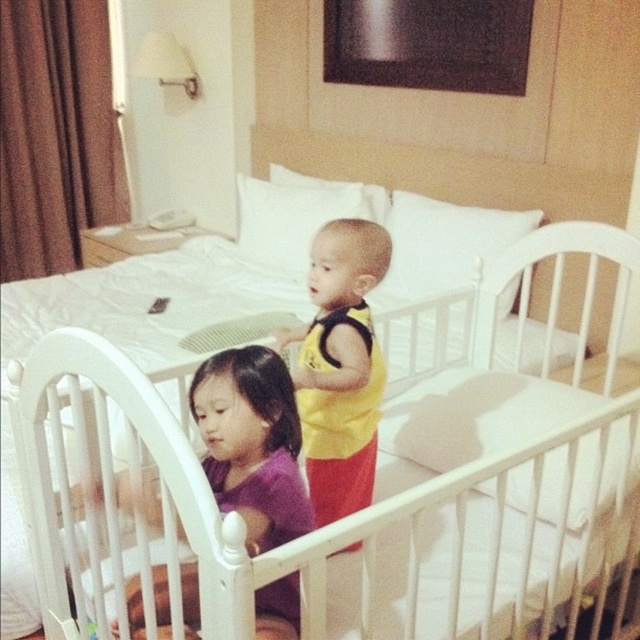
You are a parent checking on your children in the crib. You see the purple matte shirt at center and the yellow fabric baby at center. Which one is positioned to the left side?

The purple matte shirt at center is to the left of the yellow fabric baby at center, so the purple matte shirt at center is positioned to the left side.

You are a parent trying to choose between two items for your baby. You see the purple matte shirt at center and the yellow fabric baby at center in the crib. Which item is larger in size?

The purple matte shirt at center is bigger than the yellow fabric baby at center, so the purple matte shirt at center is the larger item.